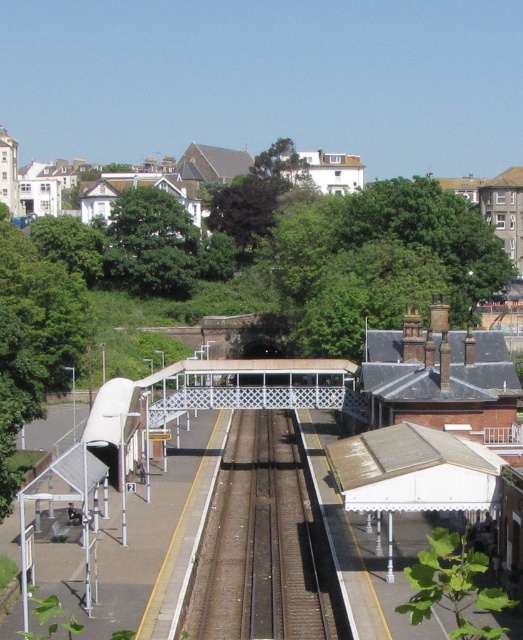
Question: Does white textured canopy at center have a smaller size compared to green leafy tree at lower right?

Choices:
 (A) no
 (B) yes

Answer: (A)

Question: Among these objects, which one is nearest to the camera?

Choices:
 (A) smooth metal train track at center
 (B) metallic silver train at left
 (C) green leafy tree at lower right
 (D) white textured canopy at center

Answer: (C)

Question: Is smooth metal train track at center thinner than metallic silver train at left?

Choices:
 (A) no
 (B) yes

Answer: (A)

Question: Does green leafy tree at lower right appear over metallic silver train at left?

Choices:
 (A) no
 (B) yes

Answer: (A)

Question: Among these points, which one is nearest to the camera?

Choices:
 (A) (129, 388)
 (B) (397, 481)

Answer: (B)

Question: Estimate the real-world distances between objects in this image. Which object is closer to the smooth metal train track at center?

Choices:
 (A) metallic silver train at left
 (B) green leafy tree at lower right

Answer: (A)